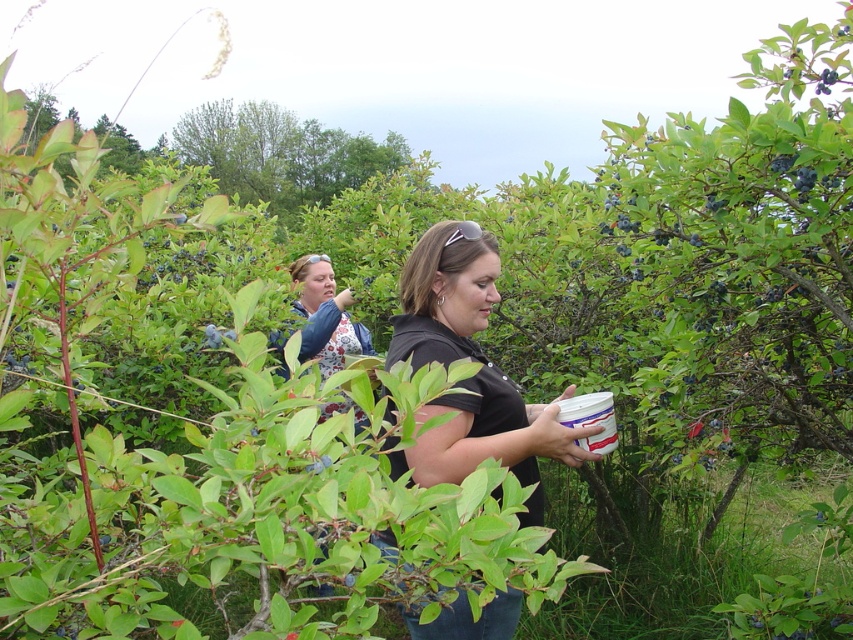
You are a photographer trying to capture a candid shot of the person picking blueberries. Your camera is currently positioned 1.48 meters away from the matte black shirt at center. Considering the ideal distance for a portrait is between 1.5 to 2 meters, is your current position too close or too far?

The camera is 1.48 meters away from the matte black shirt at center, which is slightly closer than the ideal portrait distance of 1.5 to 2 meters. To achieve the best composition, you should move back a small distance to ensure the subject is framed properly.

Based on the photo, you are standing at the point with coordinates (469, 358) in the image. What is the color of the clothing item you are standing on?

The point at (469, 358) is on the matte black shirt at center, so the clothing item you are standing on is black.